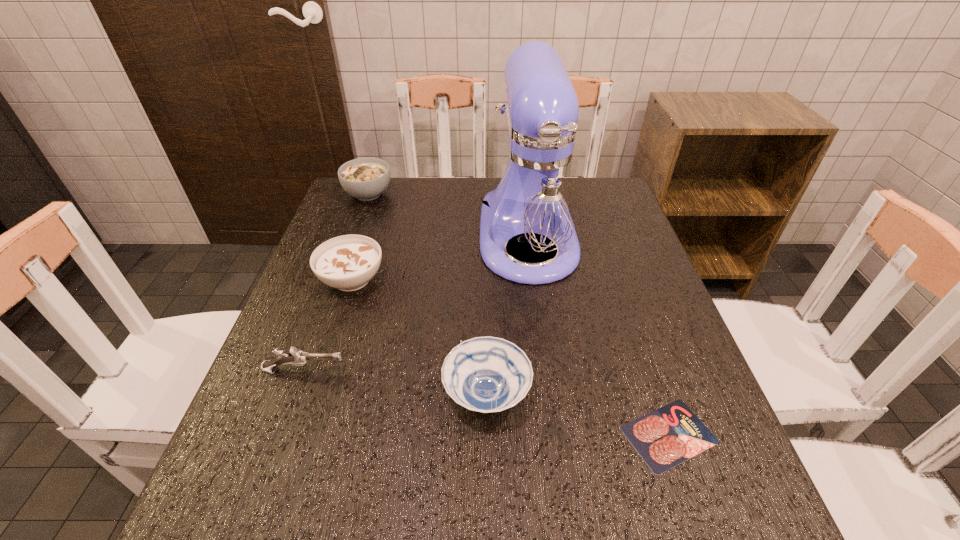
The width and height of the screenshot is (960, 540). Find the location of `mixer`. mixer is located at coordinates pyautogui.click(x=536, y=197).

You are a GUI agent. You are given a task and a screenshot of the screen. Output one action in this format:
    pyautogui.click(x=<x>, y=<y>)
    Task: Click on the tallest soup bowl
    The width and height of the screenshot is (960, 540).
    Given the screenshot: What is the action you would take?
    pyautogui.click(x=366, y=179)

What are the coordinates of `the farthest soup bowl` in the screenshot? It's located at (366, 179).

Locate an element on the screen. The height and width of the screenshot is (540, 960). the second nearest soup bowl is located at coordinates (348, 262).

Locate an element on the screen. Image resolution: width=960 pixels, height=540 pixels. the nearest soup bowl is located at coordinates point(487,374).

Identify the location of gun. (295, 357).

Image resolution: width=960 pixels, height=540 pixels. I want to click on salami, so click(664, 438).

The image size is (960, 540). What are the coordinates of `vacant region located 0.270m at the mixing area of the tallest object` in the screenshot? It's located at (549, 398).

Where is `vacant area situated on the front of the tallest soup bowl`? This screenshot has width=960, height=540. vacant area situated on the front of the tallest soup bowl is located at coordinates (345, 260).

At what (x,y) coordinates should I click in order to perform the action: click on vacant space situated on the front of the second nearest soup bowl. Please return your answer as a coordinate pair (x, y). Looking at the image, I should click on (295, 457).